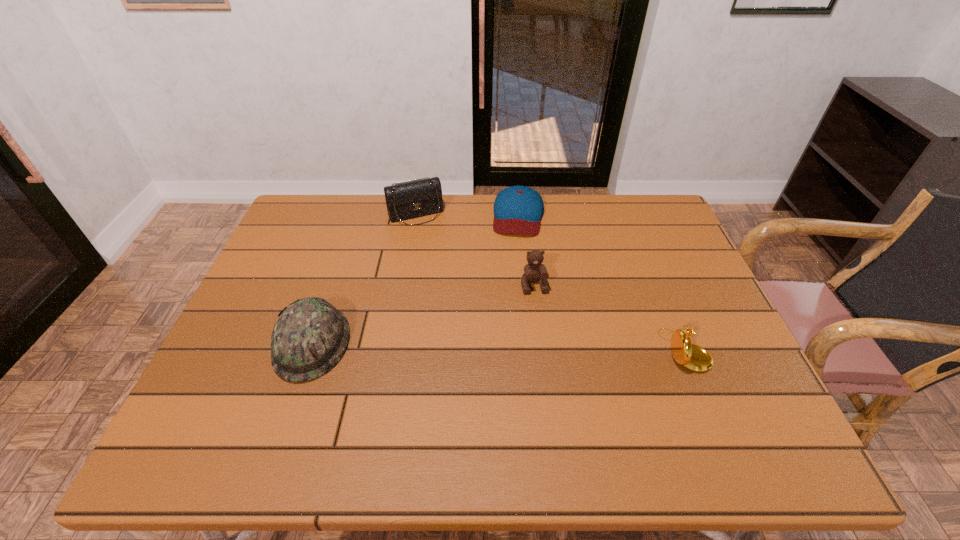
I want to click on object located at the near left corner, so [310, 336].

At what (x,y) coordinates should I click in order to perform the action: click on free region at the far edge of the desktop. Please return your answer as a coordinate pair (x, y). This screenshot has width=960, height=540. Looking at the image, I should click on (351, 198).

Image resolution: width=960 pixels, height=540 pixels. I want to click on vacant region at the near edge of the desktop, so click(x=519, y=400).

Image resolution: width=960 pixels, height=540 pixels. In the image, there is a desktop. Identify the location of vacant space at the left edge. (275, 259).

In the image, there is a desktop. Find the location of `vacant space at the right edge`. vacant space at the right edge is located at coordinates pyautogui.click(x=718, y=317).

Find the location of `vacant point at the far left corner`. vacant point at the far left corner is located at coordinates click(300, 213).

Find the location of a particular element. The height and width of the screenshot is (540, 960). free space at the near left corner of the desktop is located at coordinates (265, 392).

This screenshot has width=960, height=540. Find the location of `vacant area at the far right corner`. vacant area at the far right corner is located at coordinates (668, 227).

Find the location of a particular element. free space between the clutch bag and the pocket watch is located at coordinates (550, 282).

This screenshot has height=540, width=960. Identify the location of empty space that is in between the teddy bear and the fourth object from right to left. (475, 250).